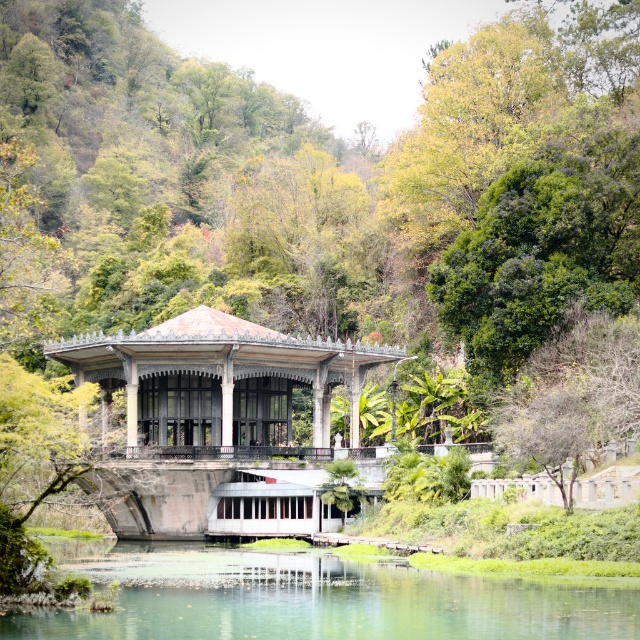
Question: Which object is farther from the camera taking this photo?

Choices:
 (A) matte gray gazebo at center
 (B) clear water at center

Answer: (A)

Question: Can you confirm if clear water at center is positioned to the right of matte gray gazebo at center?

Choices:
 (A) yes
 (B) no

Answer: (A)

Question: Which point appears farthest from the camera in this image?

Choices:
 (A) (296, 454)
 (B) (492, 614)

Answer: (A)

Question: Is clear water at center closer to camera compared to matte gray gazebo at center?

Choices:
 (A) no
 (B) yes

Answer: (B)

Question: Is clear water at center further to the viewer compared to matte gray gazebo at center?

Choices:
 (A) no
 (B) yes

Answer: (A)